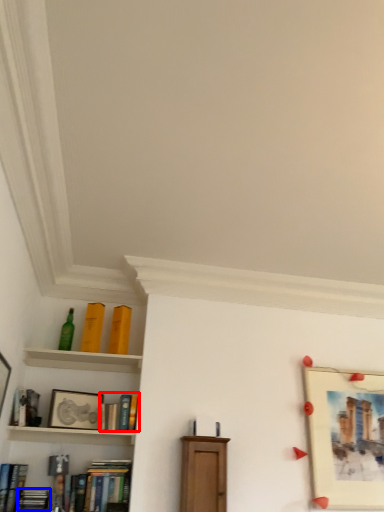
Question: Which object is further to the camera taking this photo, book (highlighted by a red box) or book (highlighted by a blue box)?

Choices:
 (A) book
 (B) book

Answer: (A)